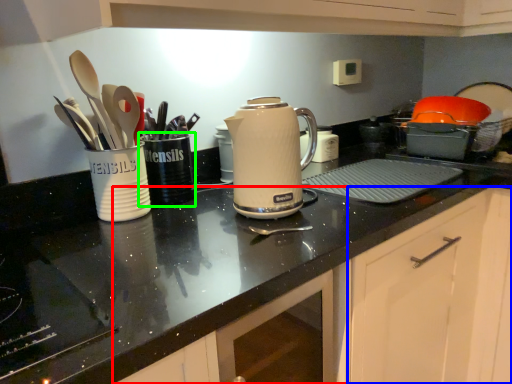
Question: Which object is positioned closest to cabinetry (highlighted by a red box)? Select from cabinetry (highlighted by a blue box) and tableware (highlighted by a green box).

Choices:
 (A) cabinetry
 (B) tableware

Answer: (A)